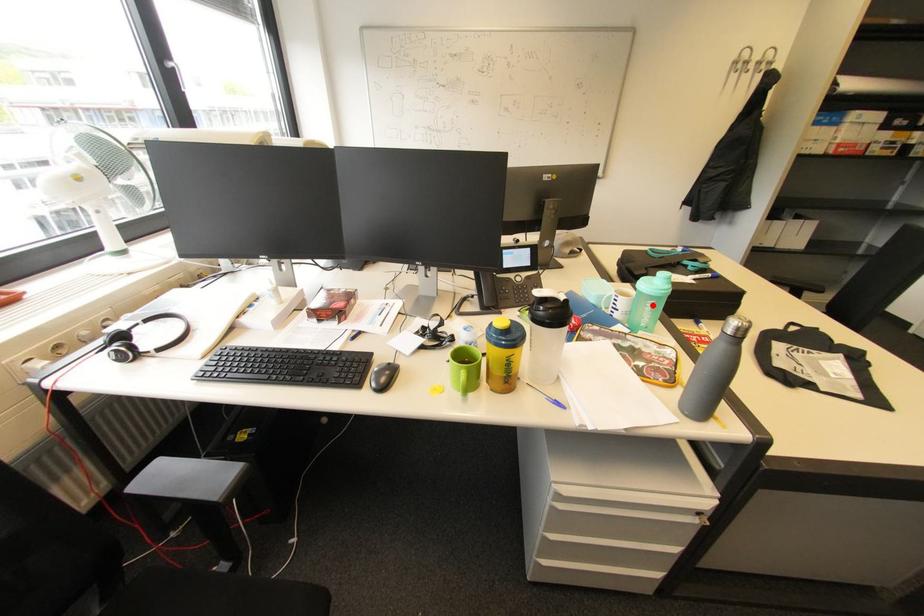
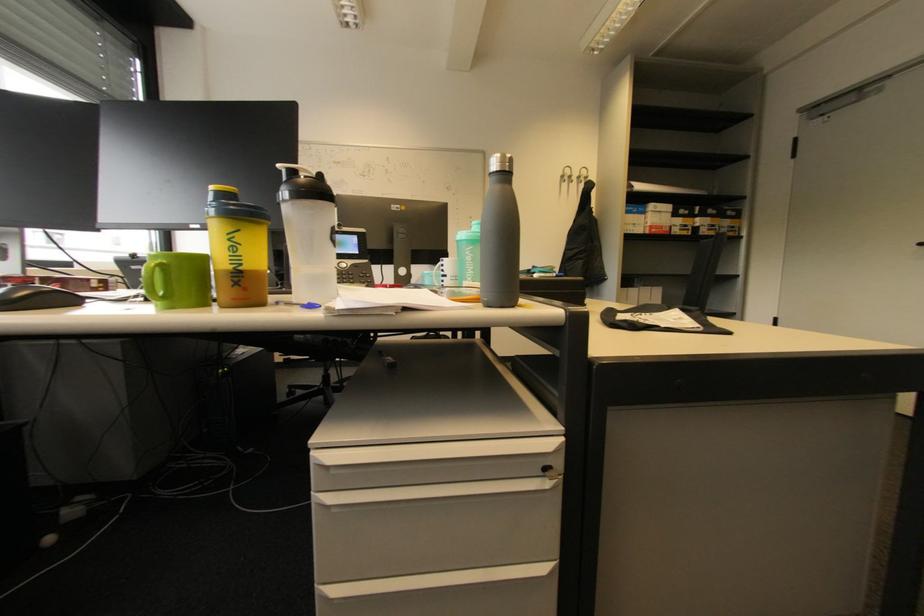
The point at the highlighted location is marked in the first image. Where is the corresponding point in the second image?

(472, 254)